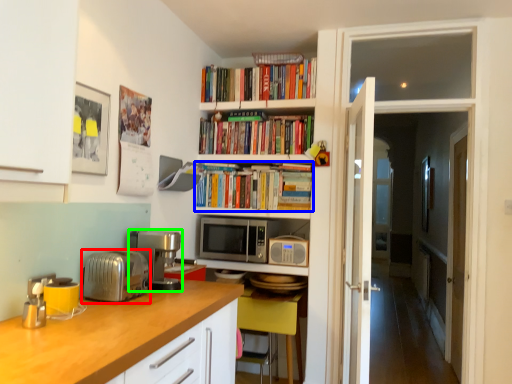
Question: Which is farther away from toaster (highlighted by a red box)? book (highlighted by a blue box) or coffee machine (highlighted by a green box)?

Choices:
 (A) book
 (B) coffee machine

Answer: (A)